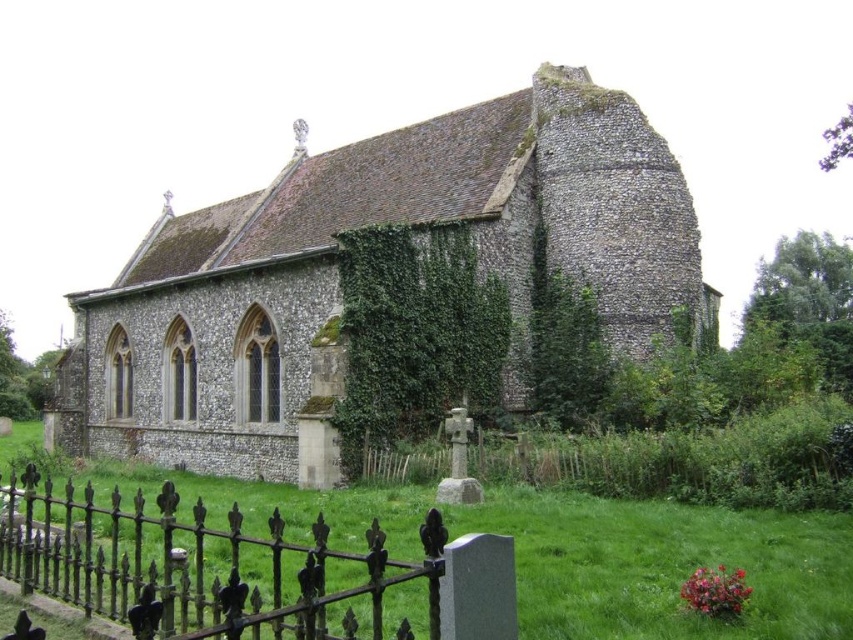
You are standing in a field near the stone church at center. You want to take a photo of the church with your smartphone. Considering the distance, will you need to zoom in to capture the entire structure in the frame?

The stone church at center is 55.87 meters away from the viewer. Since smartphones typically have a wide enough angle to capture distant objects without zooming, you can likely capture the entire structure without zooming in.

You are a landscape architect planning to install a new pathway between the stone church at center and the rusty iron fence at lower left. Considering their relative widths, which structure should you place the pathway closer to?

The stone church at center might be wider than the rusty iron fence at lower left, so the pathway should be placed closer to the rusty iron fence at lower left to accommodate the churchs greater width.

You are standing at the point marked by the coordinate point at (337,273) in the image. What structure are you facing directly?

The point marked by the coordinate point at (337,273) directly faces the stone church at center.